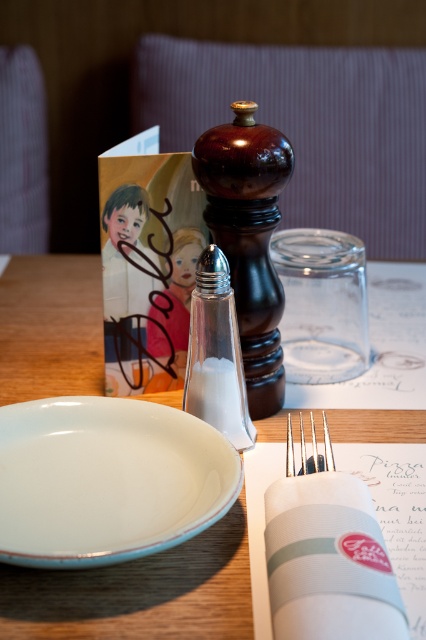
Consider the image. Does white glossy platter at lower left have a lesser width compared to satin silver fork at center?

No.

Is point (66, 508) behind point (325, 440)?

No, (66, 508) is in front of (325, 440).

Find the location of `white glossy platter at lower left`. white glossy platter at lower left is located at coordinates (106, 480).

The height and width of the screenshot is (640, 426). Identify the location of matte ceramic plate at center-left. (140, 593).

Is point (23, 611) closer to viewer compared to point (111, 481)?

Yes, it is.

Is point (31, 356) farther from viewer compared to point (170, 499)?

That is True.

Locate an element on the screen. matte ceramic plate at center-left is located at coordinates (140, 593).

The width and height of the screenshot is (426, 640). Find the location of `matte ceramic plate at center-left`. matte ceramic plate at center-left is located at coordinates (140, 593).

Is matte ceramic plate at center-left wider than clear glass salt shaker at center?

Correct, the width of matte ceramic plate at center-left exceeds that of clear glass salt shaker at center.

Is point (319, 428) positioned in front of point (239, 388)?

No, it is not.

The image size is (426, 640). I want to click on matte ceramic plate at center-left, so click(140, 593).